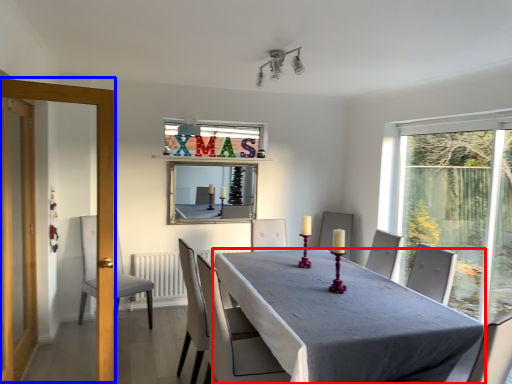
Question: Which object is closer to the camera taking this photo, table (highlighted by a red box) or screen door (highlighted by a blue box)?

Choices:
 (A) table
 (B) screen door

Answer: (A)